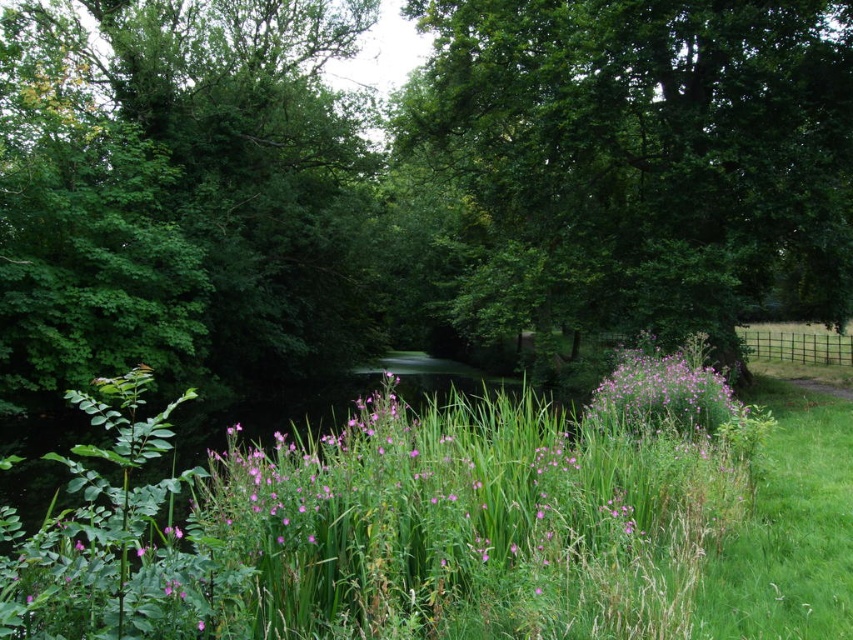
Question: Which of the following is the farthest from the observer?

Choices:
 (A) (833, 65)
 (B) (618, 387)

Answer: (A)

Question: Where is green leafy tree at center located in relation to purple matte flowers at center-right in the image?

Choices:
 (A) right
 (B) left

Answer: (A)

Question: Is green leafy tree at center wider than pink matte flower at center?

Choices:
 (A) no
 (B) yes

Answer: (B)

Question: Does purple matte flowers at center-right have a larger size compared to pink matte flower at center?

Choices:
 (A) yes
 (B) no

Answer: (A)

Question: Which object is positioned farthest from the green leafy tree at center?

Choices:
 (A) purple matte flowers at center-right
 (B) pink matte flower at center

Answer: (B)

Question: Which of the following is the farthest from the observer?

Choices:
 (A) (543, 460)
 (B) (672, 28)

Answer: (B)